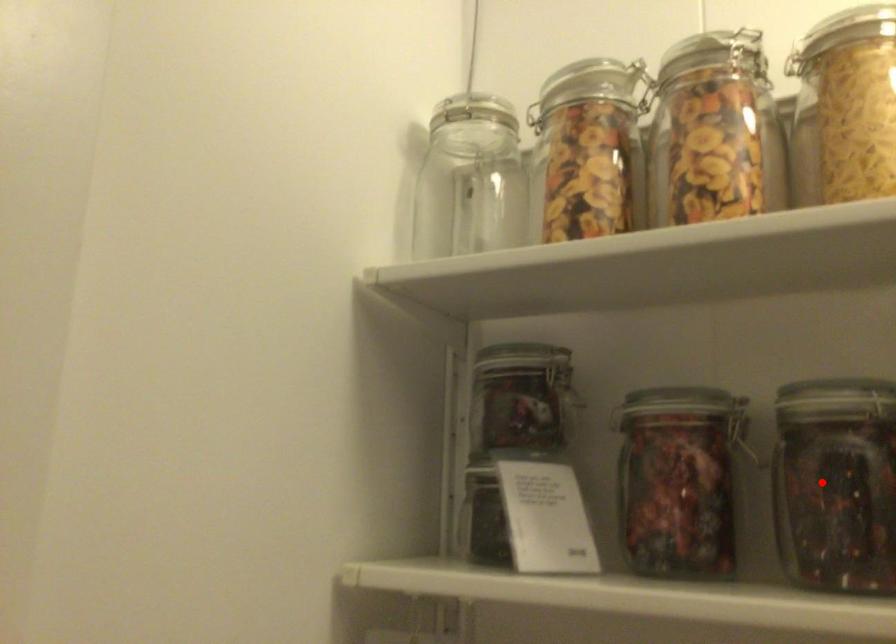
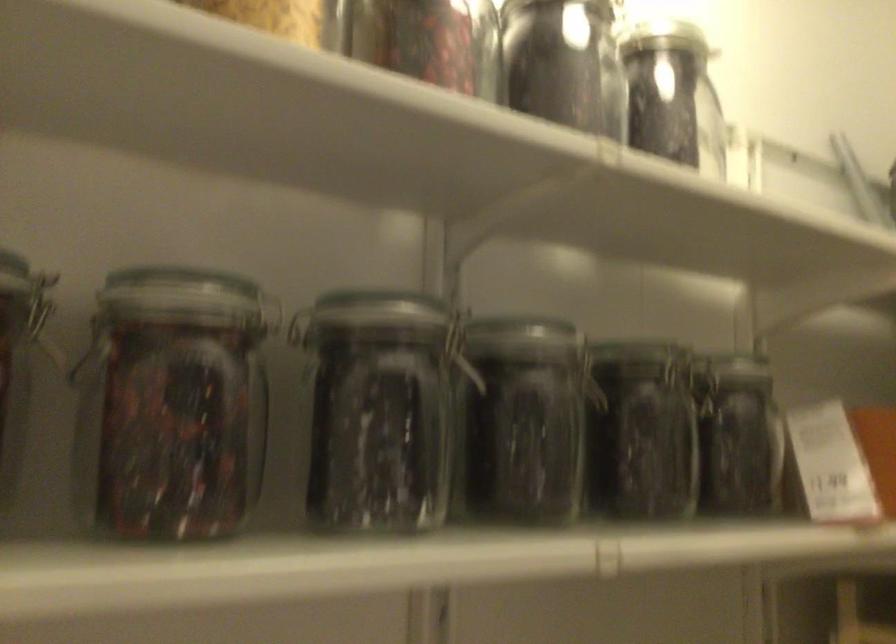
Question: I am providing you with two images of the same scene from different viewpoints. A red point is shown in image1. For the corresponding object point in image2, is it positioned nearer or farther from the camera?

Choices:
 (A) Nearer
 (B) Farther

Answer: (A)